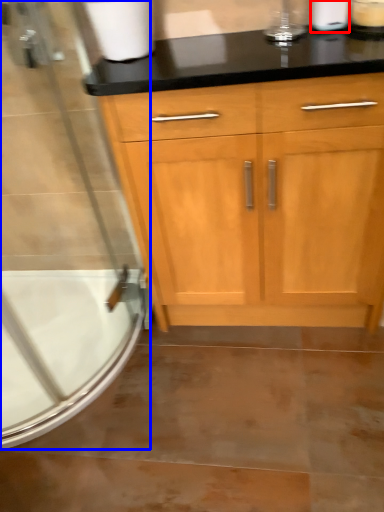
Question: Among these objects, which one is nearest to the camera, toilet paper (highlighted by a red box) or screen door (highlighted by a blue box)?

Choices:
 (A) toilet paper
 (B) screen door

Answer: (B)